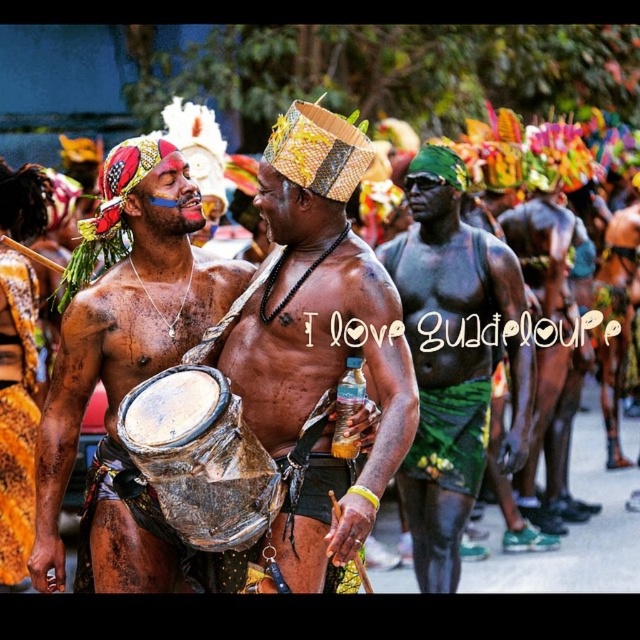
Does green woven cloth at center appear under green textured fabric at center?

Yes, green woven cloth at center is below green textured fabric at center.

Can you confirm if green woven cloth at center is positioned to the left of green textured fabric at center?

Correct, you'll find green woven cloth at center to the left of green textured fabric at center.

Which is behind, point (432, 497) or point (573, 312)?

The point (573, 312) is behind.

At what (x,y) coordinates should I click in order to perform the action: click on green woven cloth at center. Please return your answer as a coordinate pair (x, y). Looking at the image, I should click on (445, 355).

Who is positioned more to the right, shiny metallic drum at center or textured yellow fabric at left?

shiny metallic drum at center

Is shiny metallic drum at center shorter than textured yellow fabric at left?

Incorrect, shiny metallic drum at center's height does not fall short of textured yellow fabric at left's.

Where is `shiny metallic drum at center`? This screenshot has width=640, height=640. shiny metallic drum at center is located at coordinates (316, 344).

Can you confirm if shiny metallic drum at center is smaller than green woven cloth at center?

Yes.

Between shiny metallic drum at center and green woven cloth at center, which one appears on the left side from the viewer's perspective?

Positioned to the left is shiny metallic drum at center.

At what (x,y) coordinates should I click in order to perform the action: click on shiny metallic drum at center. Please return your answer as a coordinate pair (x, y). This screenshot has height=640, width=640. Looking at the image, I should click on (316, 344).